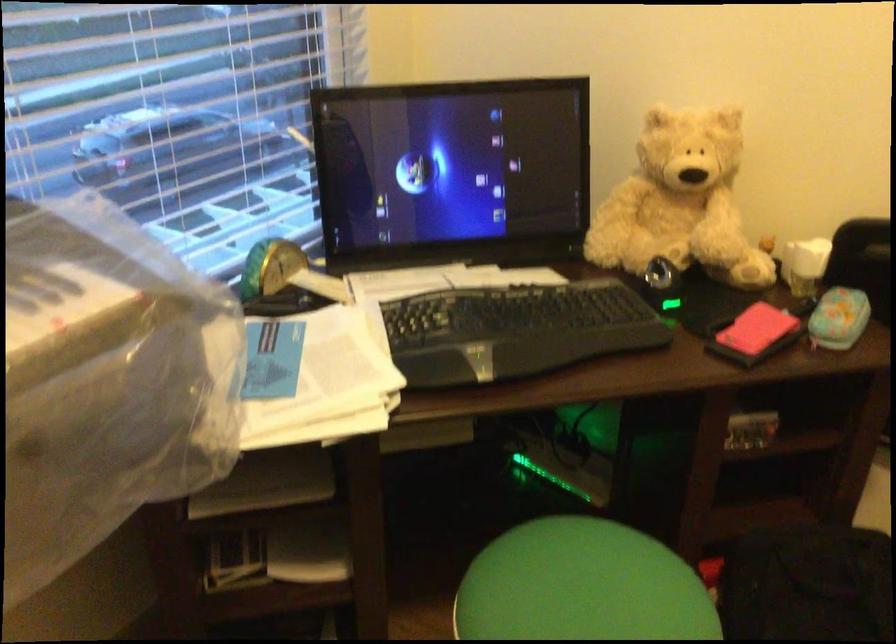
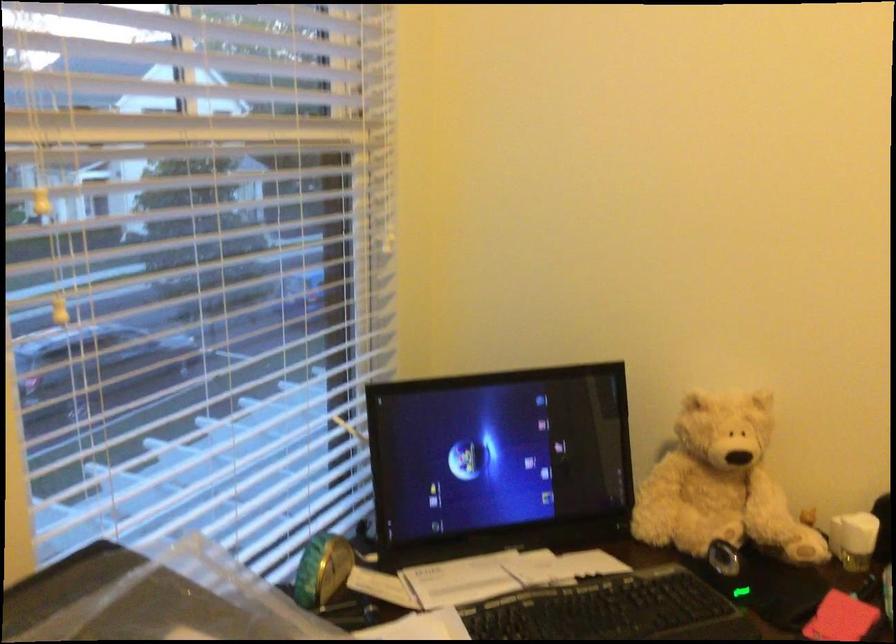
Where in the second image is the point corresponding to point 681,207 from the first image?

(720, 484)